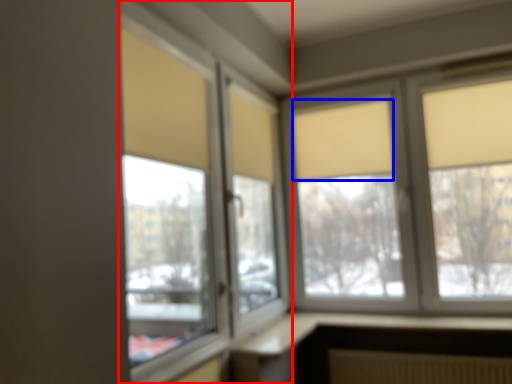
Question: Which point is further to the camera, window (highlighted by a red box) or curtain (highlighted by a blue box)?

Choices:
 (A) window
 (B) curtain

Answer: (B)